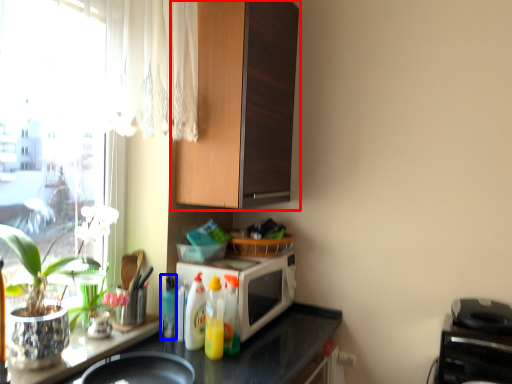
Question: Among these objects, which one is nearest to the camera, cabinetry (highlighted by a red box) or bottle (highlighted by a blue box)?

Choices:
 (A) cabinetry
 (B) bottle

Answer: (A)